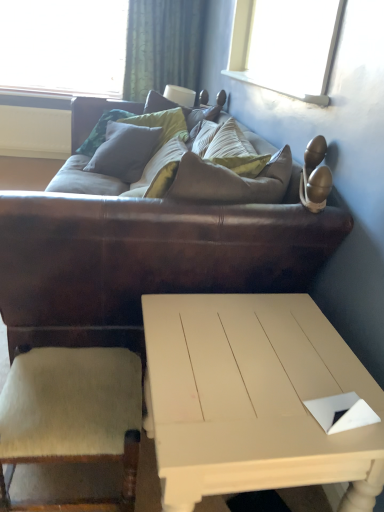
Question: Should I look upward or downward to see green textured curtain at upper center?

Choices:
 (A) down
 (B) up

Answer: (B)

Question: Is white painted wood coffee table at lower center at the right side of brown leather couch at center?

Choices:
 (A) yes
 (B) no

Answer: (A)

Question: Is white painted wood coffee table at lower center behind brown leather couch at center?

Choices:
 (A) no
 (B) yes

Answer: (A)

Question: Could you tell me if white painted wood coffee table at lower center is turned towards brown leather couch at center?

Choices:
 (A) no
 (B) yes

Answer: (A)

Question: Is white painted wood coffee table at lower center not inside brown leather couch at center?

Choices:
 (A) yes
 (B) no

Answer: (A)

Question: Is white painted wood coffee table at lower center beside brown leather couch at center?

Choices:
 (A) no
 (B) yes

Answer: (A)

Question: Can you confirm if white painted wood coffee table at lower center is smaller than brown leather couch at center?

Choices:
 (A) no
 (B) yes

Answer: (B)

Question: From the image's perspective, would you say green textured curtain at upper center is shown under beige wool armchair at lower left?

Choices:
 (A) yes
 (B) no

Answer: (B)

Question: Is green textured curtain at upper center further to camera compared to beige wool armchair at lower left?

Choices:
 (A) yes
 (B) no

Answer: (A)

Question: From a real-world perspective, does green textured curtain at upper center sit lower than beige wool armchair at lower left?

Choices:
 (A) yes
 (B) no

Answer: (B)

Question: Is green textured curtain at upper center placed right next to beige wool armchair at lower left?

Choices:
 (A) yes
 (B) no

Answer: (B)

Question: Can you confirm if green textured curtain at upper center is smaller than beige wool armchair at lower left?

Choices:
 (A) yes
 (B) no

Answer: (B)

Question: Would you say beige wool armchair at lower left is part of green textured curtain at upper center's contents?

Choices:
 (A) yes
 (B) no

Answer: (B)

Question: Can you confirm if beige wool armchair at lower left is taller than white painted wood coffee table at lower center?

Choices:
 (A) yes
 (B) no

Answer: (B)